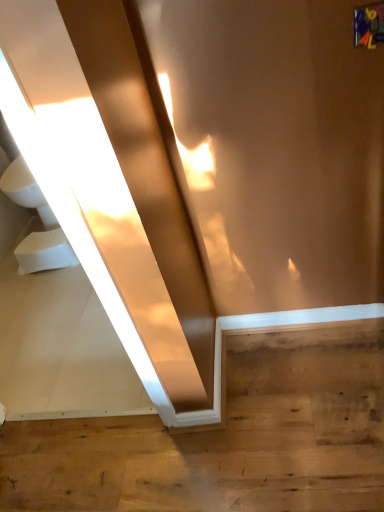
At what (x,y) coordinates should I click in order to perform the action: click on free space above white foam toilet bowl at lower left (from a real-world perspective). Please return your answer as a coordinate pair (x, y). Looking at the image, I should click on (42, 234).